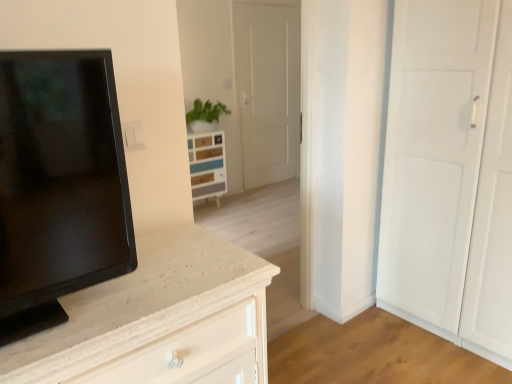
Question: Is wooden chest of drawers at center closer to camera compared to black glossy tv at left?

Choices:
 (A) no
 (B) yes

Answer: (A)

Question: Is wooden chest of drawers at center wider than black glossy tv at left?

Choices:
 (A) yes
 (B) no

Answer: (A)

Question: Considering the relative sizes of wooden chest of drawers at center and black glossy tv at left in the image provided, is wooden chest of drawers at center smaller than black glossy tv at left?

Choices:
 (A) yes
 (B) no

Answer: (B)

Question: Does wooden chest of drawers at center have a lesser width compared to black glossy tv at left?

Choices:
 (A) yes
 (B) no

Answer: (B)

Question: From a real-world perspective, is wooden chest of drawers at center located beneath black glossy tv at left?

Choices:
 (A) yes
 (B) no

Answer: (A)

Question: From a real-world perspective, is wooden chest of drawers at center positioned over black glossy tv at left based on gravity?

Choices:
 (A) yes
 (B) no

Answer: (B)

Question: Does black glossy tv at left have a greater height compared to wooden chest of drawers at center?

Choices:
 (A) no
 (B) yes

Answer: (A)

Question: Can you confirm if black glossy tv at left is positioned to the left of wooden chest of drawers at center?

Choices:
 (A) yes
 (B) no

Answer: (B)

Question: Is wooden chest of drawers at center inside black glossy tv at left?

Choices:
 (A) no
 (B) yes

Answer: (A)

Question: Is the position of black glossy tv at left less distant than that of wooden chest of drawers at center?

Choices:
 (A) no
 (B) yes

Answer: (B)

Question: From the image's perspective, is black glossy tv at left under wooden chest of drawers at center?

Choices:
 (A) no
 (B) yes

Answer: (B)

Question: Could you tell me if black glossy tv at left is turned towards wooden chest of drawers at center?

Choices:
 (A) yes
 (B) no

Answer: (B)

Question: Is wooden chest of drawers at center wider or thinner than black glossy tv at left?

Choices:
 (A) wide
 (B) thin

Answer: (A)